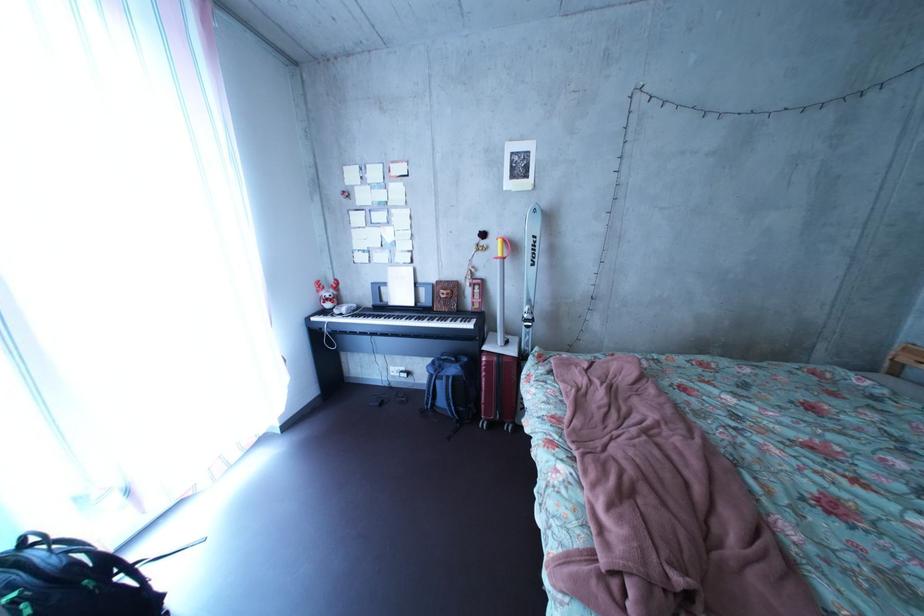
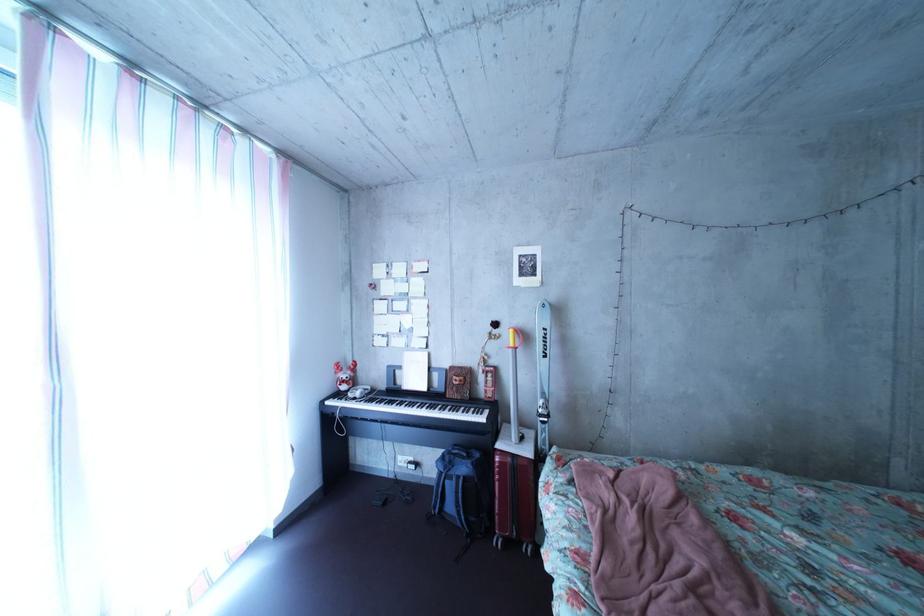
Find the pixel in the second image that matches (x=404, y=325) in the first image.

(416, 411)